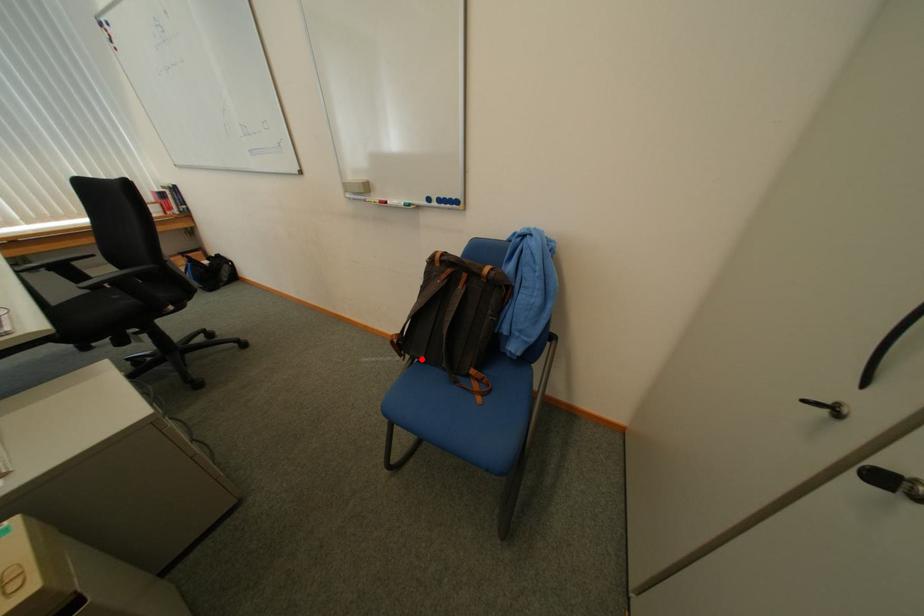
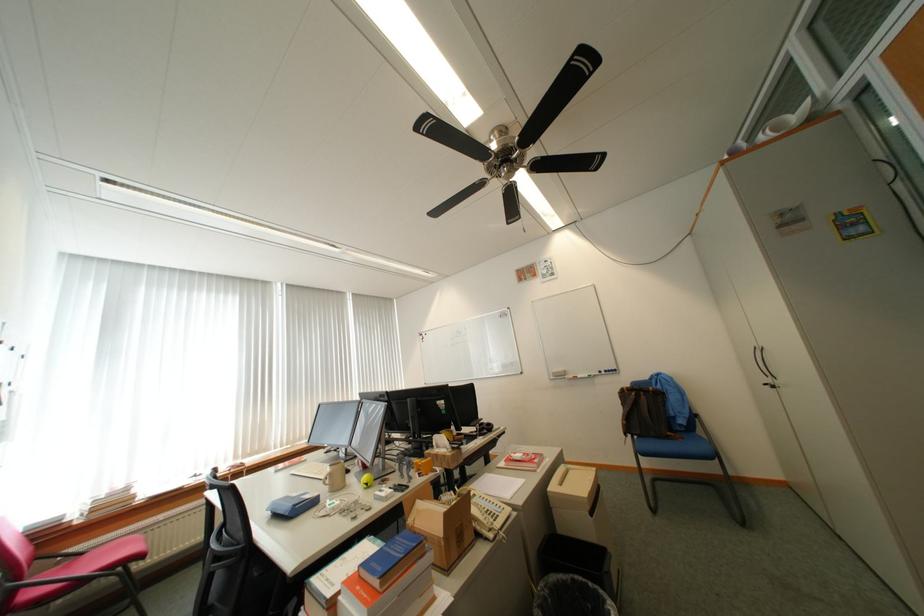
Question: I am providing you with two images of the same scene from different viewpoints. A red point is shown in image1. For the corresponding object point in image2, is it positioned nearer or farther from the camera?

Choices:
 (A) Nearer
 (B) Farther

Answer: (B)